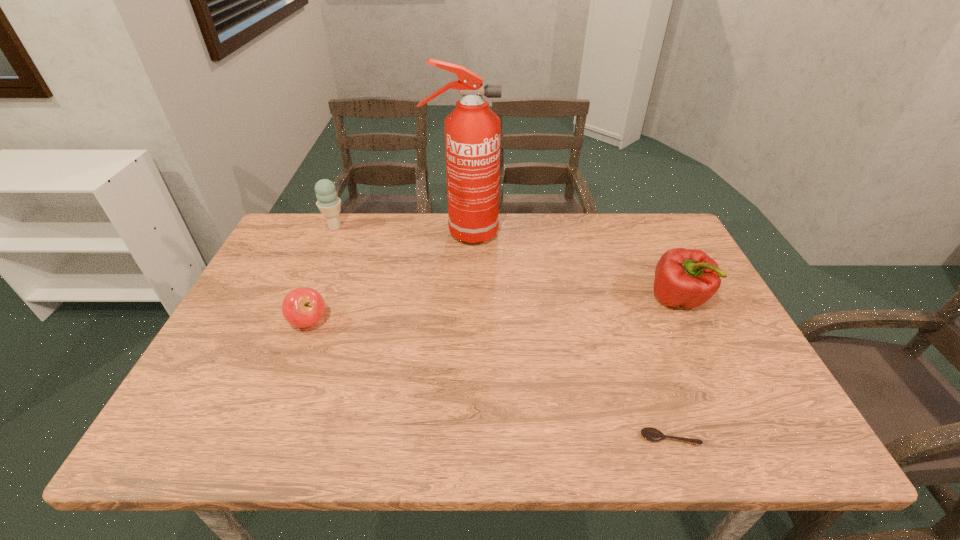
The width and height of the screenshot is (960, 540). I want to click on the third object from left to right, so click(472, 130).

You are a GUI agent. You are given a task and a screenshot of the screen. Output one action in this format:
    pyautogui.click(x=<x>, y=<y>)
    Task: Click on the fire extinguisher
    The image size is (960, 540).
    Given the screenshot: What is the action you would take?
    pyautogui.click(x=472, y=130)

You are a GUI agent. You are given a task and a screenshot of the screen. Output one action in this format:
    pyautogui.click(x=<x>, y=<y>)
    Task: Click on the ice cream
    The height and width of the screenshot is (540, 960).
    Given the screenshot: What is the action you would take?
    pyautogui.click(x=328, y=203)

In order to click on the rightmost object in this screenshot , I will do `click(684, 277)`.

Identify the location of apple. The width and height of the screenshot is (960, 540). (303, 307).

Identify the location of soupspoon. The image size is (960, 540). (652, 434).

Image resolution: width=960 pixels, height=540 pixels. Identify the location of the fourth object from left to right. (652, 434).

The height and width of the screenshot is (540, 960). Find the location of `vacant area situated 0.120m at the nozzle of the fire extinguisher`. vacant area situated 0.120m at the nozzle of the fire extinguisher is located at coordinates (537, 233).

In order to click on vacant space positioned 0.140m on the right of the ice cream in this screenshot , I will do (390, 227).

Find the location of `free space located on the back of the rightmost object`. free space located on the back of the rightmost object is located at coordinates (660, 265).